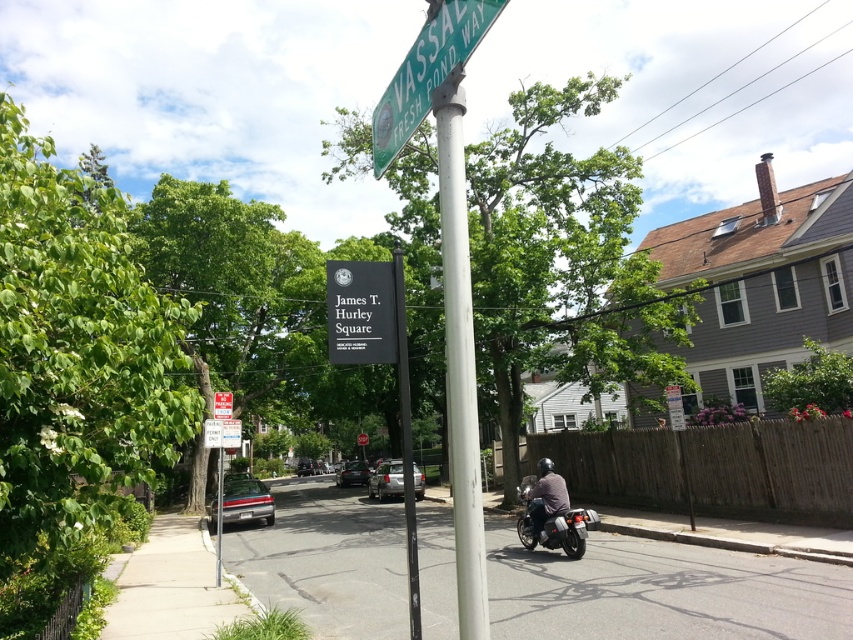
You are standing at the intersection of VASSAL FRESH POND WAY and James T. Hurley Square. You notice two points marked on the ground in front of you. The first point is at coordinates point (463, 470) and the second is at point (544, 515). Which point is closer to your current position?

Point (463, 470) is closer to the camera than point (544, 515), so the first point is closer to your current position.

You are a delivery driver who needs to park your vehicle, which is 5 meters long, along the gray asphalt road at center. The parking space available is between the white metallic pole at center and the end of the road. Can your vehicle fit in this parking space?

The gray asphalt road at center is 3.43 meters from the white metallic pole at center. Since the parking space is only 3.43 meters long and your vehicle is 5 meters long, it cannot fit in this space.